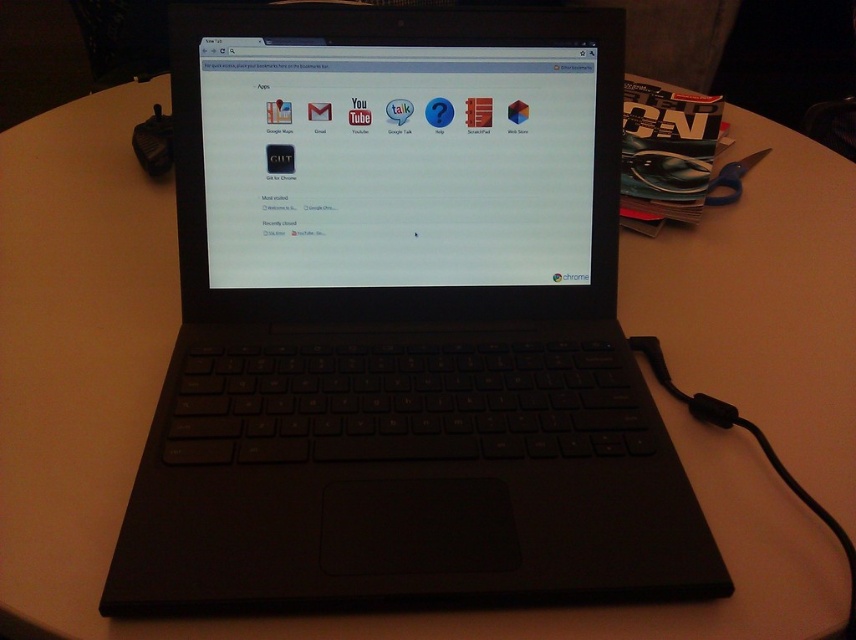
Question: Which object appears closest to the camera in this image?

Choices:
 (A) black plastic mouse at upper left
 (B) black matte laptop at center

Answer: (B)

Question: Which object appears closest to the camera in this image?

Choices:
 (A) black matte laptop at center
 (B) black plastic mouse at upper left

Answer: (A)

Question: Does black matte laptop at center appear on the left side of black plastic mouse at upper left?

Choices:
 (A) no
 (B) yes

Answer: (A)

Question: Can you confirm if black matte laptop at center is positioned to the right of black plastic mouse at upper left?

Choices:
 (A) yes
 (B) no

Answer: (A)

Question: Is black matte laptop at center bigger than black plastic mouse at upper left?

Choices:
 (A) yes
 (B) no

Answer: (A)